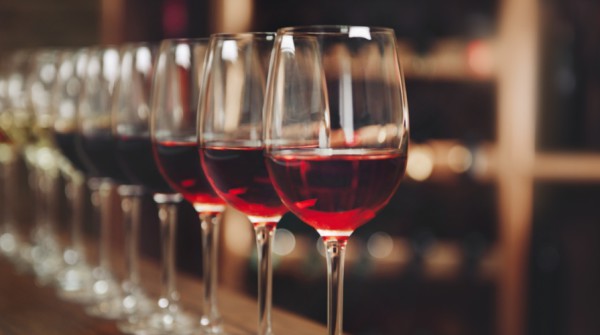
The width and height of the screenshot is (600, 335). I want to click on wine in glasses, so click(342, 177), click(248, 171), click(182, 163), click(142, 162), click(99, 156), click(69, 149), click(47, 141), click(25, 138), click(7, 127).